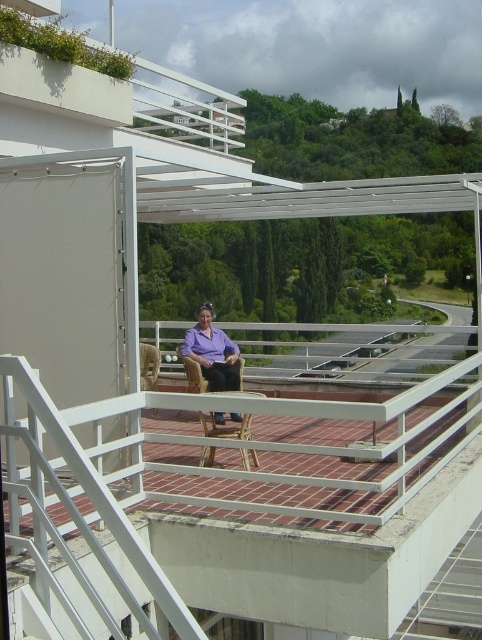
Question: Is purple fabric chair at center thinner than brown woven chair at center?

Choices:
 (A) no
 (B) yes

Answer: (A)

Question: Which point appears closest to the camera in this image?

Choices:
 (A) (213, 376)
 (B) (248, 426)

Answer: (B)

Question: Is purple fabric chair at center bigger than brown woven chair at center?

Choices:
 (A) no
 (B) yes

Answer: (B)

Question: Does purple fabric chair at center appear on the left side of brown woven chair at center?

Choices:
 (A) yes
 (B) no

Answer: (A)